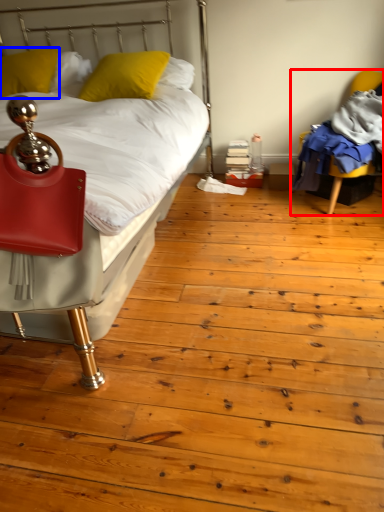
Question: Among these objects, which one is farthest to the camera, chair (highlighted by a red box) or pillow (highlighted by a blue box)?

Choices:
 (A) chair
 (B) pillow

Answer: (B)